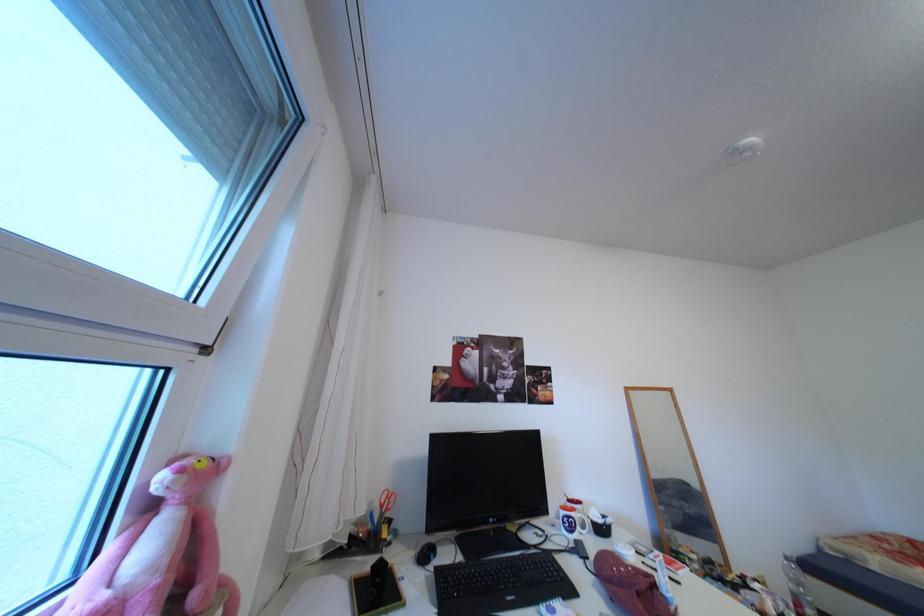
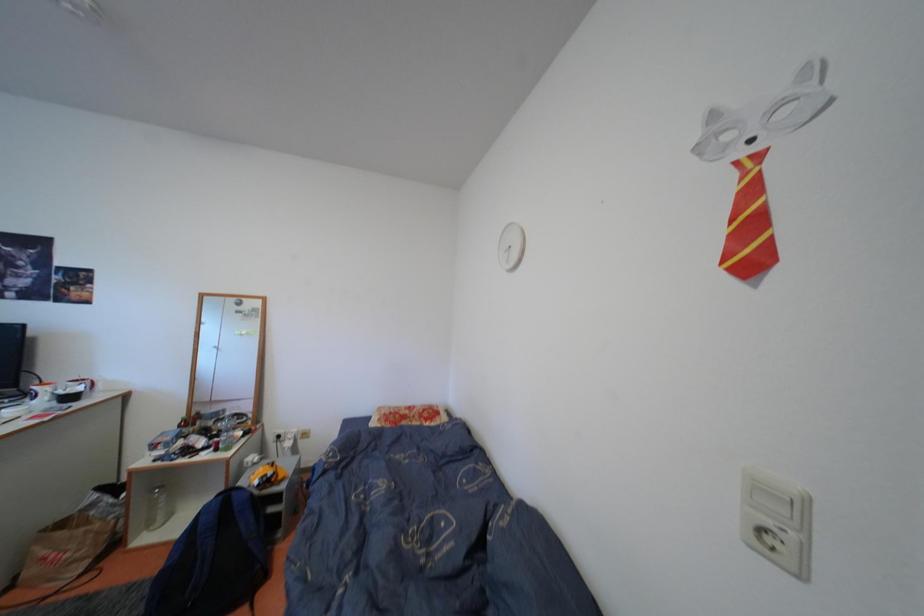
Question: In a continuous first-person perspective shot, in which direction is the camera moving?

Choices:
 (A) Left
 (B) Right
 (C) Forward
 (D) Backward

Answer: (B)